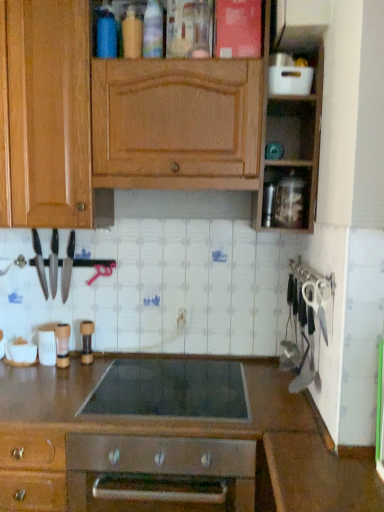
You are a GUI agent. You are given a task and a screenshot of the screen. Output one action in this format:
    pyautogui.click(x=<x>, y=<y>)
    Task: Click on the vacant region in front of brown matte pepper grinder at center, which is the fourth appliance from bottom to top
    The height and width of the screenshot is (512, 384).
    Given the screenshot: What is the action you would take?
    pyautogui.click(x=79, y=377)